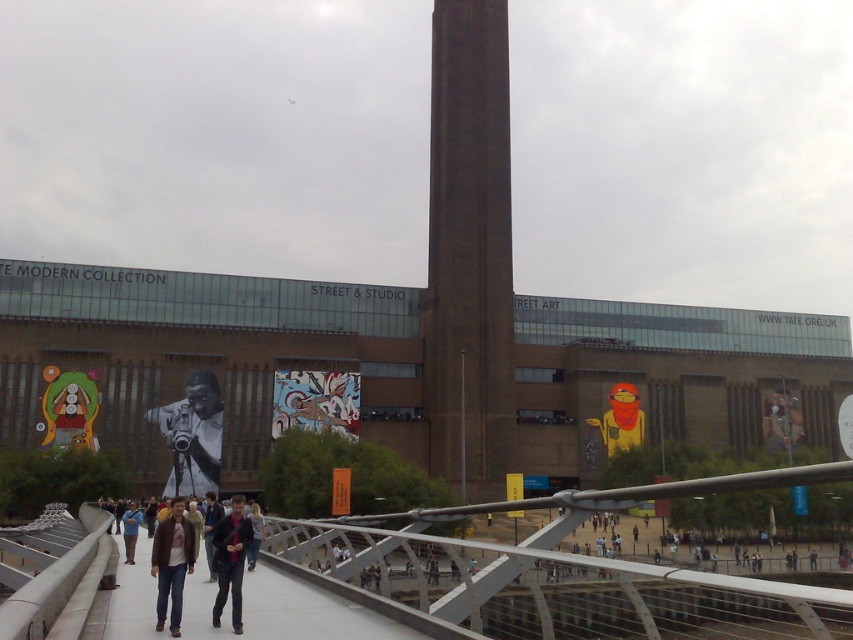
Question: Does blue denim jacket at center have a lesser width compared to dark brown leather jacket at center?

Choices:
 (A) yes
 (B) no

Answer: (A)

Question: In this image, where is brown brick tower at center located relative to dark brown leather jacket at center?

Choices:
 (A) below
 (B) above

Answer: (B)

Question: Is brick wall at center thinner than matte black camera at center?

Choices:
 (A) yes
 (B) no

Answer: (B)

Question: Which of the following is the closest to the observer?

Choices:
 (A) brick wall at center
 (B) blue denim jacket at center
 (C) matte black camera at center
 (D) brown leather jacket at center

Answer: (D)

Question: Which point is farther from the camera taking this photo?

Choices:
 (A) (479, 176)
 (B) (175, 502)

Answer: (A)

Question: Considering the real-world distances, which object is farthest from the brown brick tower at center?

Choices:
 (A) blue denim jacket at center
 (B) dark brown leather jacket at center

Answer: (A)